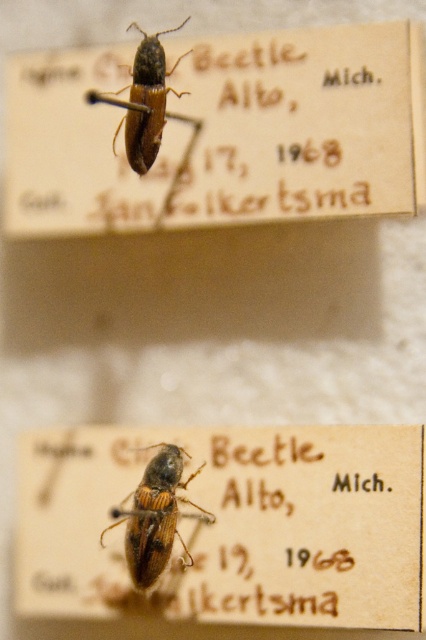
Based on the photo, you are a museum visitor observing the pinned beetles. Which beetle, the brown matte beetle at center or the shiny brown beetle at upper center, is positioned closer to the front of the display?

The brown matte beetle at center is closer to the front of the display because the shiny brown beetle at upper center is positioned behind it.

You are a museum curator examining two beetles displayed in a case. You need to determine which beetle is shorter. The beetles are the brown matte beetle at center and the shiny brown beetle at upper center. Which one is shorter?

The brown matte beetle at center is not as tall as the shiny brown beetle at upper center, so the brown matte beetle at center is shorter.